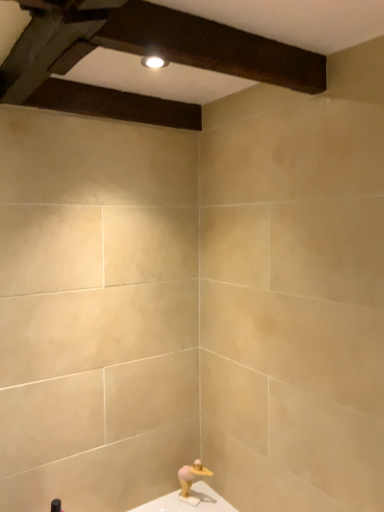
Question: Can you confirm if pink matte sculpture at lower center is shorter than dark brown wood at upper center?

Choices:
 (A) no
 (B) yes

Answer: (A)

Question: Considering the relative sizes of pink matte sculpture at lower center and dark brown wood at upper center in the image provided, is pink matte sculpture at lower center thinner than dark brown wood at upper center?

Choices:
 (A) yes
 (B) no

Answer: (A)

Question: Is pink matte sculpture at lower center wider than dark brown wood at upper center?

Choices:
 (A) yes
 (B) no

Answer: (B)

Question: Is pink matte sculpture at lower center located outside dark brown wood at upper center?

Choices:
 (A) no
 (B) yes

Answer: (B)

Question: Is pink matte sculpture at lower center to the right of dark brown wood at upper center from the viewer's perspective?

Choices:
 (A) no
 (B) yes

Answer: (B)

Question: From a real-world perspective, does pink matte sculpture at lower center sit lower than dark brown wood at upper center?

Choices:
 (A) yes
 (B) no

Answer: (A)

Question: Is dark brown wood at upper center positioned with its back to pink matte sculpture at lower center?

Choices:
 (A) yes
 (B) no

Answer: (B)

Question: Is dark brown wood at upper center aimed at pink matte sculpture at lower center?

Choices:
 (A) yes
 (B) no

Answer: (B)

Question: From the image's perspective, does dark brown wood at upper center appear higher than pink matte sculpture at lower center?

Choices:
 (A) no
 (B) yes

Answer: (B)

Question: Is dark brown wood at upper center closer to the viewer compared to pink matte sculpture at lower center?

Choices:
 (A) no
 (B) yes

Answer: (B)

Question: Does dark brown wood at upper center have a lesser width compared to pink matte sculpture at lower center?

Choices:
 (A) yes
 (B) no

Answer: (B)

Question: Considering the relative positions of dark brown wood at upper center and pink matte sculpture at lower center in the image provided, is dark brown wood at upper center behind pink matte sculpture at lower center?

Choices:
 (A) yes
 (B) no

Answer: (B)

Question: From the image's perspective, is pink matte sculpture at lower center located above or below dark brown wood at upper center?

Choices:
 (A) below
 (B) above

Answer: (A)